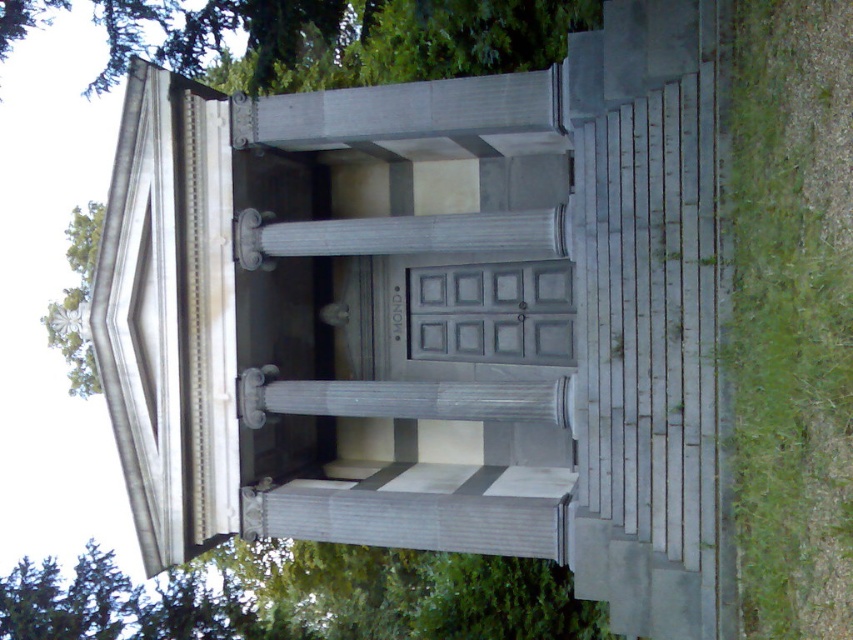
Question: Can you confirm if green leafy tree at lower left is positioned below green leafy tree at upper left?

Choices:
 (A) yes
 (B) no

Answer: (A)

Question: Does green leafy tree at lower left appear on the right side of green leafy tree at upper left?

Choices:
 (A) no
 (B) yes

Answer: (B)

Question: Which point is farther from the camera taking this photo?

Choices:
 (A) (96, 237)
 (B) (224, 595)

Answer: (A)

Question: Does green leafy tree at lower left lie in front of green leafy tree at upper left?

Choices:
 (A) yes
 (B) no

Answer: (B)

Question: Among these objects, which one is nearest to the camera?

Choices:
 (A) green leafy tree at lower left
 (B) green leafy tree at upper left

Answer: (B)

Question: Which of the following is the closest to the observer?

Choices:
 (A) green leafy tree at lower left
 (B) green leafy tree at upper left

Answer: (B)